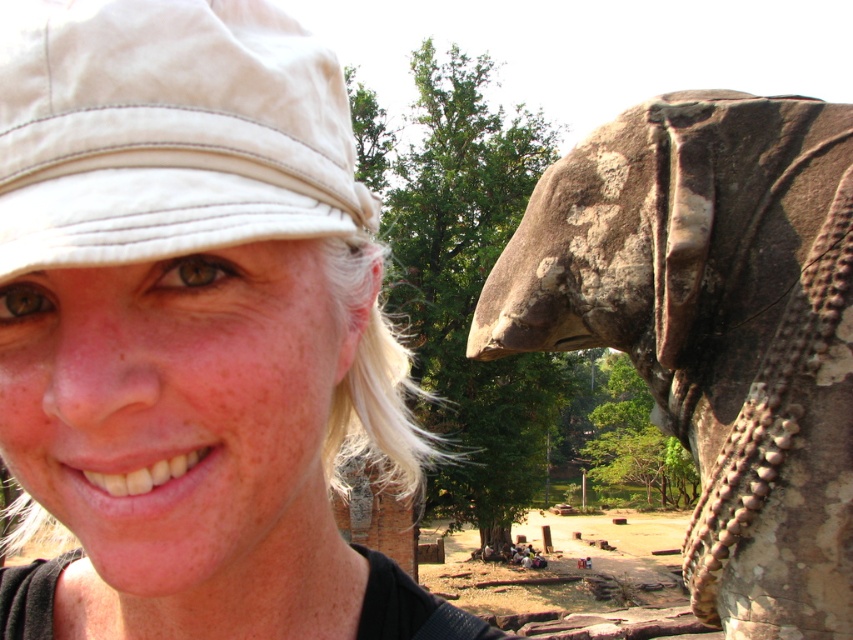
Consider the image. Which of these two, white matte hat at upper left or white cotton cap at upper left, stands shorter?

white cotton cap at upper left is shorter.

Does white matte hat at upper left lie in front of white cotton cap at upper left?

No, white matte hat at upper left is further to the viewer.

Does point (252, 188) come farther from viewer compared to point (195, 45)?

No.

Image resolution: width=853 pixels, height=640 pixels. What are the coordinates of `white matte hat at upper left` in the screenshot? It's located at pos(190,328).

Which is above, rusty stone elephant at right or white cotton cap at upper left?

Positioned higher is white cotton cap at upper left.

Does rusty stone elephant at right appear on the right side of white cotton cap at upper left?

Indeed, rusty stone elephant at right is positioned on the right side of white cotton cap at upper left.

What do you see at coordinates (714, 326) in the screenshot? Image resolution: width=853 pixels, height=640 pixels. I see `rusty stone elephant at right` at bounding box center [714, 326].

Where is `rusty stone elephant at right`? This screenshot has height=640, width=853. rusty stone elephant at right is located at coordinates (714, 326).

Can you confirm if white matte hat at upper left is positioned to the left of rusty stone elephant at right?

Yes, white matte hat at upper left is to the left of rusty stone elephant at right.

Which of these two, white matte hat at upper left or rusty stone elephant at right, stands shorter?

white matte hat at upper left

At what (x,y) coordinates should I click in order to perform the action: click on white matte hat at upper left. Please return your answer as a coordinate pair (x, y). The width and height of the screenshot is (853, 640). Looking at the image, I should click on tap(190, 328).

Where is `white matte hat at upper left`? The height and width of the screenshot is (640, 853). white matte hat at upper left is located at coordinates (190, 328).